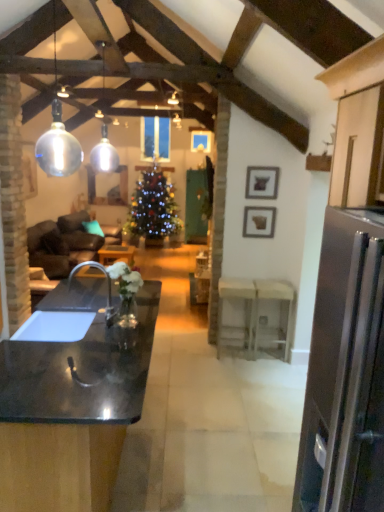
Question: Would you say shiny green christmas tree at center is inside or outside glossy black countertop at center?

Choices:
 (A) inside
 (B) outside

Answer: (B)

Question: In the image, is shiny green christmas tree at center positioned in front of or behind glossy black countertop at center?

Choices:
 (A) front
 (B) behind

Answer: (B)

Question: Which of these objects is positioned farthest from the white glossy table at center, which is the third table from left to right?

Choices:
 (A) matte gray picture frame at upper right, positioned as the 1th picture frame in back-to-front order
 (B) shiny green christmas tree at center
 (C) white wood table at center, the 3th table from the back
 (D) black matte sink at lower left
 (E) wooden picture frame at upper center, which is the second picture frame in back-to-front order

Answer: (B)

Question: Which object is positioned closest to the transparent glass pendant light at upper left, the 2th lamp positioned from the back?

Choices:
 (A) shiny green christmas tree at center
 (B) black matte sink at lower left
 (C) white glossy table at center, positioned as the third table in right-to-left order
 (D) matte gray picture frame at upper right, positioned as the 1th picture frame in back-to-front order
 (E) white wood table at center, the first table from the front

Answer: (D)